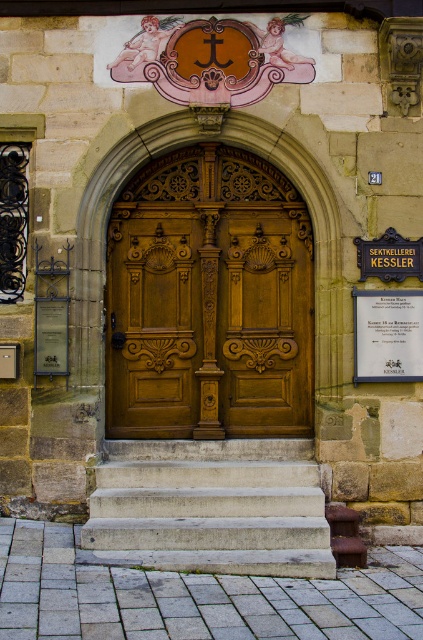
Question: Can you confirm if matte gold plaque at center is positioned below matte silver plaque at lower left?

Choices:
 (A) no
 (B) yes

Answer: (B)

Question: Which of the following is the farthest from the observer?

Choices:
 (A) wooden door at center
 (B) matte silver plaque at lower left
 (C) polished wood door at center
 (D) white concrete stairs at center

Answer: (A)

Question: Based on their relative distances, which object is farther from the wooden door at center?

Choices:
 (A) white concrete stairs at center
 (B) matte gold plaque at center

Answer: (B)

Question: Among these points, which one is farthest from the camera?

Choices:
 (A) (359, 348)
 (B) (156, 406)

Answer: (B)

Question: Does polished wood door at center have a greater width compared to matte gold plaque at center?

Choices:
 (A) no
 (B) yes

Answer: (B)

Question: Is white concrete stairs at center wider than matte silver plaque at lower left?

Choices:
 (A) no
 (B) yes

Answer: (B)